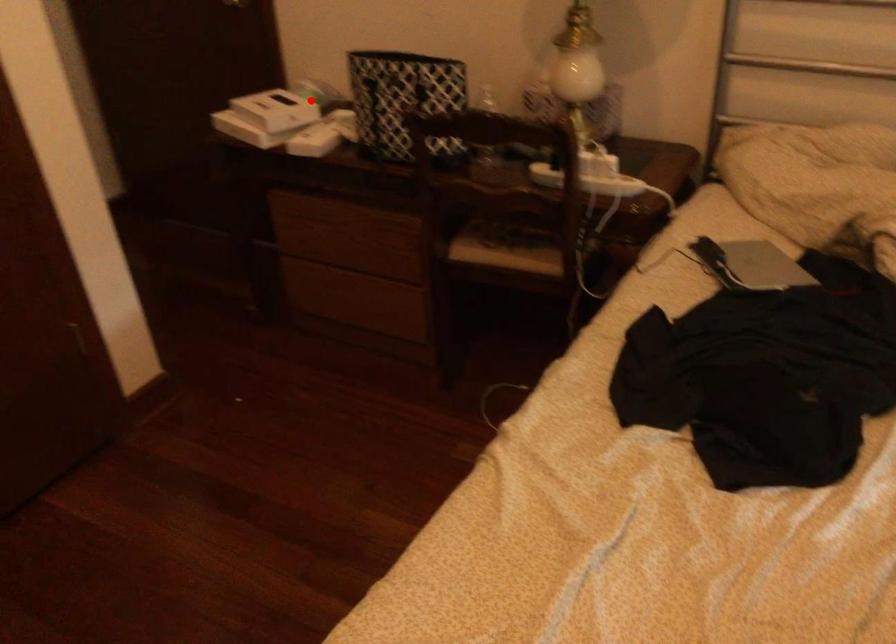
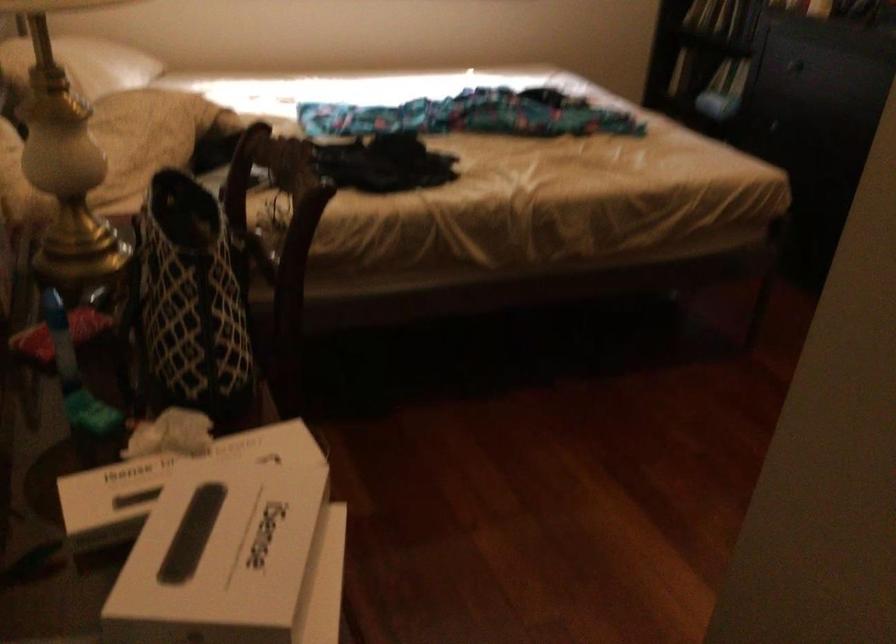
Question: I am providing you with two images of the same scene from different viewpoints. In image1, a red point is highlighted. Considering the same 3D point in image2, which of the following is correct?

Choices:
 (A) It is closer
 (B) It is farther

Answer: (A)